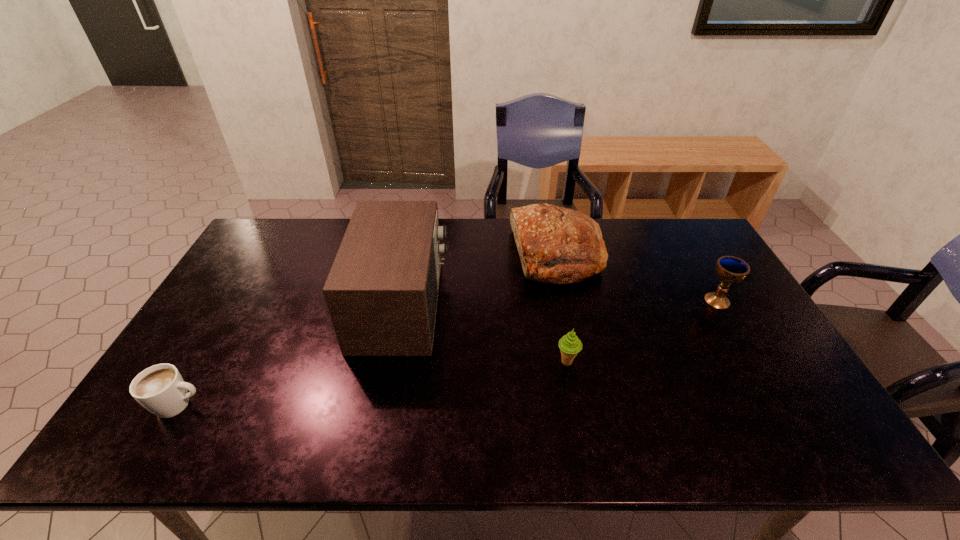
I want to click on free space between the icecream and the fourth shortest object, so click(562, 309).

Locate an element on the screen. This screenshot has width=960, height=540. free space between the rightmost object and the tallest object is located at coordinates (560, 302).

Where is `object that stands as the fourth closest to the rightmost object`? object that stands as the fourth closest to the rightmost object is located at coordinates (160, 389).

Locate which object is the second closest to the tallest object. Please provide its 2D coordinates. Your answer should be formatted as a tuple, i.e. [(x, y)], where the tuple contains the x and y coordinates of a point satisfying the conditions above.

[(569, 344)]

The image size is (960, 540). Find the location of `free space that satisfies the following two spatial constraints: 1. on the back side of the icecream; 2. on the front-facing side of the tallest object`. free space that satisfies the following two spatial constraints: 1. on the back side of the icecream; 2. on the front-facing side of the tallest object is located at coordinates (557, 304).

Image resolution: width=960 pixels, height=540 pixels. What are the coordinates of `free space that satisfies the following two spatial constraints: 1. at the sliced front of the rightmost object; 2. on the right side of the second tallest object` in the screenshot? It's located at (566, 300).

Find the location of a particular element. The image size is (960, 540). vacant area that satisfies the following two spatial constraints: 1. at the sliced front of the rightmost object; 2. on the right side of the bread is located at coordinates (566, 300).

Where is `vacant space that satisfies the following two spatial constraints: 1. on the back side of the chalice; 2. at the sliced front of the bread`? The height and width of the screenshot is (540, 960). vacant space that satisfies the following two spatial constraints: 1. on the back side of the chalice; 2. at the sliced front of the bread is located at coordinates (691, 256).

I want to click on vacant area in the image that satisfies the following two spatial constraints: 1. at the sliced front of the bread; 2. on the back side of the rightmost object, so click(x=566, y=300).

I want to click on free space that satisfies the following two spatial constraints: 1. on the front-facing side of the fourth object from right to left; 2. on the back side of the icecream, so click(391, 362).